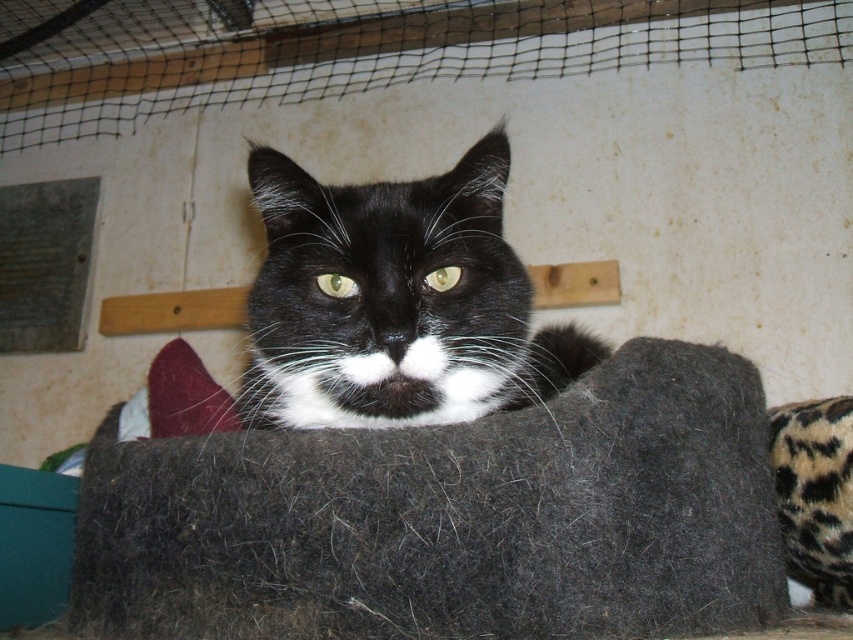
You are a cat owner who wants to ensure your cat can comfortably stretch out on the fuzzy charcoal cat bed at center. Considering the cat is currently sitting on the black fur cat at center, can the cat reach the edge of the bed easily?

The fuzzy charcoal cat bed at center is closer to the viewer than the black fur cat at center, so the cat would have to move forward to reach the edge of the bed from its current position on the black fur cat at center.

Consider the image. You have a cat toy that is 10 inches long. You want to place it on the fuzzy charcoal cat bed at center where the black fur cat at center is resting. Can the cat toy fit on the bed without overlapping the cat?

The fuzzy charcoal cat bed at center might be wider than black fur cat at center, so there is a possibility that the cat toy can fit on the bed without overlapping the cat. However, the exact dimensions are uncertain based on the provided information.

Based on the photo, you need to place a new toy for the black fur cat at center. Considering the size of the fuzzy charcoal cat bed at center, will the cat have enough space to play with the toy inside the bed?

The fuzzy charcoal cat bed at center occupies less space than black fur cat at center, so the cat may not have enough space to play with the toy inside the bed.